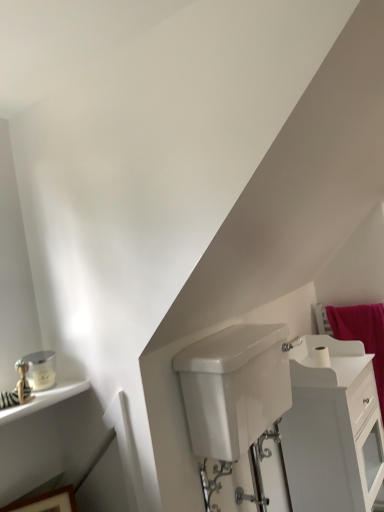
Question: From the image's perspective, is white glossy cabinet at lower right located above or below white matte toilet paper at upper right?

Choices:
 (A) below
 (B) above

Answer: (A)

Question: Is white glossy cabinet at lower right to the left or to the right of white matte toilet paper at upper right in the image?

Choices:
 (A) right
 (B) left

Answer: (A)

Question: Estimate the real-world distances between objects in this image. Which object is closer to the white glossy tank at lower center?

Choices:
 (A) pink fabric bath towel at right
 (B) white matte toilet paper at upper right
 (C) white glossy cabinet at lower right
 (D) wooden picture frame at lower left

Answer: (C)

Question: Which is nearer to the white matte toilet paper at upper right?

Choices:
 (A) pink fabric bath towel at right
 (B) white glossy cabinet at lower right
 (C) white glossy tank at lower center
 (D) wooden picture frame at lower left

Answer: (B)